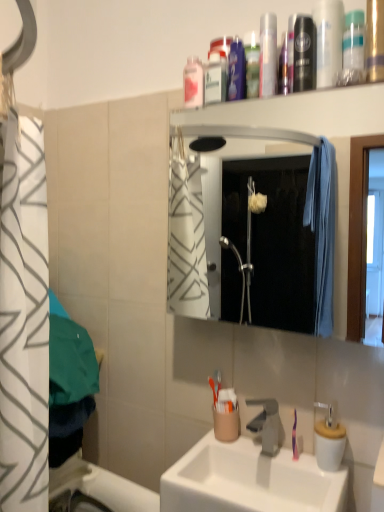
Question: In the image, is translucent plastic mouthwash at upper center, arranged as the second mouthwash when viewed from the back, positioned in front of or behind pink plastic mouthwash at upper center, marked as the 1th mouthwash in a back-to-front arrangement?

Choices:
 (A) front
 (B) behind

Answer: (A)

Question: In the image, is translucent plastic mouthwash at upper center, placed as the 3th mouthwash when sorted from front to back, on the left side or the right side of pink plastic mouthwash at upper center, which is counted as the fourth mouthwash, starting from the right?

Choices:
 (A) right
 (B) left

Answer: (A)

Question: Which of these objects is positioned closest to the metallic silver canister at upper right?

Choices:
 (A) translucent plastic mouthwash at upper center, which is the 2th mouthwash from left to right
 (B) white ceramic sink at center
 (C) metallic silver mouthwash at upper center, which appears as the 1th mouthwash when viewed from the front
 (D) white glossy mirror at upper center
 (E) pink plastic toothbrush at lower right

Answer: (C)

Question: Estimate the real-world distances between objects in this image. Which object is closer to the metallic silver mouthwash at upper center, the 4th mouthwash viewed from the back?

Choices:
 (A) pink plastic mouthwash at upper center, marked as the 1th mouthwash in a back-to-front arrangement
 (B) white ceramic sink at center
 (C) translucent plastic mouthwash at upper center, which is the 2th mouthwash from left to right
 (D) white glossy mirror at upper center
 (E) metallic silver canister at upper right

Answer: (E)